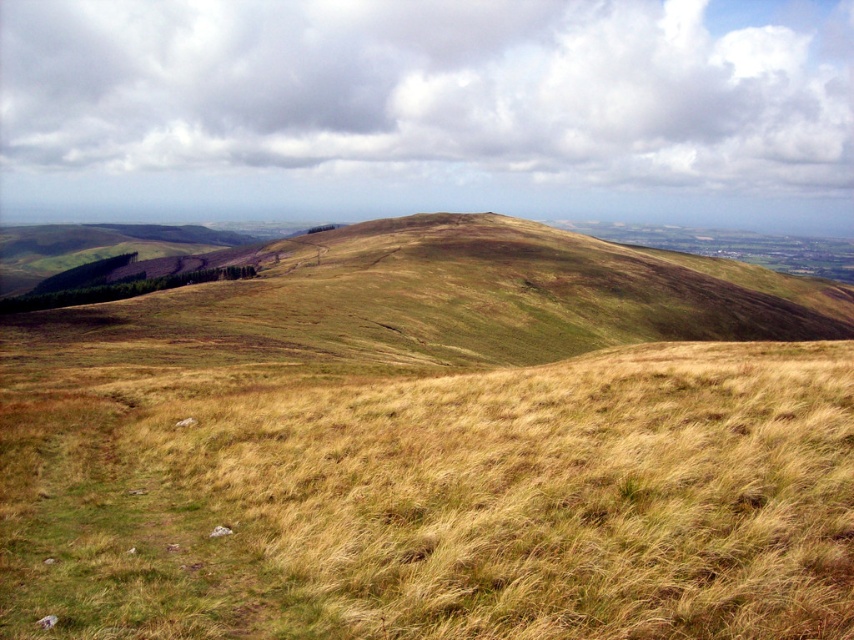
You are standing on the dry grass at center and want to climb up to the green grassy hillside at center. Which direction should you move to reach the hillside?

The dry grass at center is located below the green grassy hillside at center, so you should move upward to reach the hillside.

You are standing at the origin point in the image and want to reach the dry grass at center. According to the coordinates provided, in which direction should you move to reach it?

The dry grass at center is located at coordinates point [442,500], so you should move towards the right and slightly upwards from your current position at the origin to reach it.